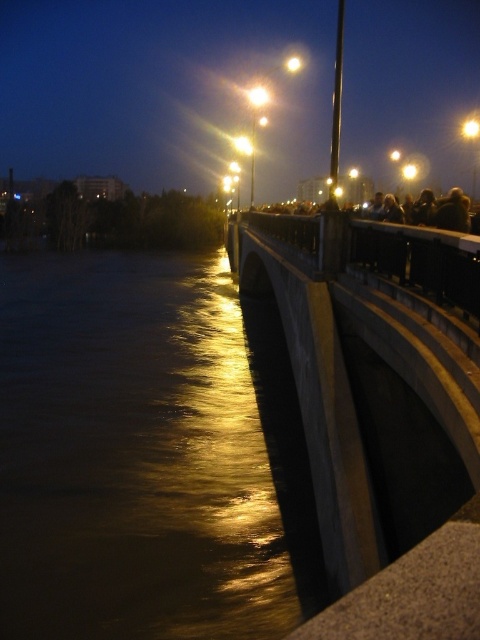
You are standing on the bridge and want to take a photo of the golden reflective water at lower left. Based on its coordinates, where should you aim your camera?

The golden reflective water at lower left is located at coordinates point (148, 452), so aim your camera towards that point.

You are standing on the bridge and want to take a photo of the golden reflective water at lower left. According to the coordinates provided, where exactly should you position yourself to capture the reflection?

The golden reflective water at lower left is located at coordinates point (148,452), so you should position yourself at that coordinate point to capture the reflection.